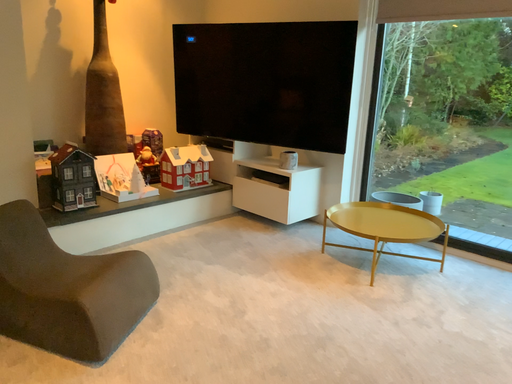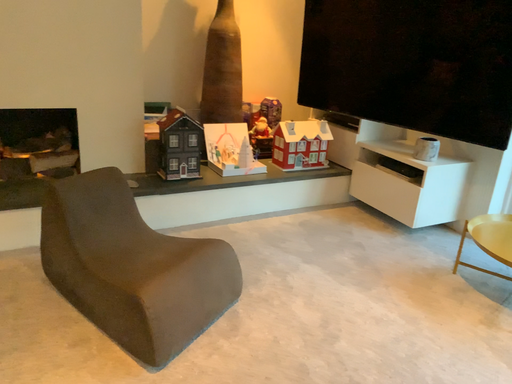
Question: Which way did the camera rotate in the video?

Choices:
 (A) rotated left
 (B) rotated right

Answer: (A)